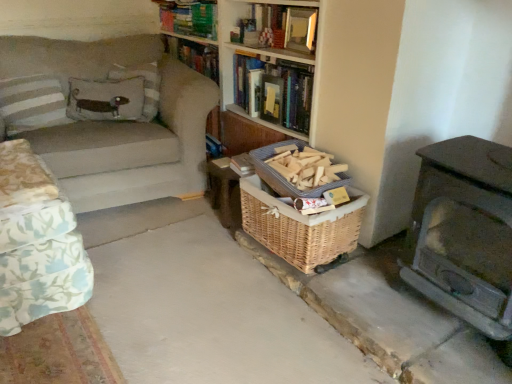
Question: From a real-world perspective, is hardcover book at upper center, arranged as the third book when viewed from the top, physically located above or below hardcover books at upper center, which ranks as the third book in bottom-to-top order?

Choices:
 (A) above
 (B) below

Answer: (B)

Question: Is hardcover book at upper center, the 1th book positioned from the bottom, taller or shorter than hardcover books at upper center, which ranks as the third book in bottom-to-top order?

Choices:
 (A) short
 (B) tall

Answer: (B)

Question: Which of these objects is positioned farthest from the hardcover books at upper center, which is counted as the 1th book, starting from the top?

Choices:
 (A) woven brown basket at center, the second basket positioned from the bottom
 (B) floral fabric couch at left, positioned as the 2th studio couch in back-to-front order
 (C) brown fabric pillow at upper left, the 2th pillow positioned from the left
 (D) hardcover book at upper center, arranged as the third book when viewed from the top
 (E) hardcover book at upper center, the 2th book in the bottom-to-top sequence

Answer: (B)

Question: Which object is positioned farthest from the hardcover book at upper center, arranged as the third book when viewed from the top?

Choices:
 (A) brown fabric pillow at upper left, the second pillow when ordered from right to left
 (B) brown textured basket at lower right
 (C) woven wood basket at lower center, marked as the second basket in a top-to-bottom arrangement
 (D) velvet-like brown pillow at upper left, the 1th pillow in the right-to-left sequence
 (E) beige fabric couch at left, placed as the second studio couch when sorted from front to back

Answer: (B)